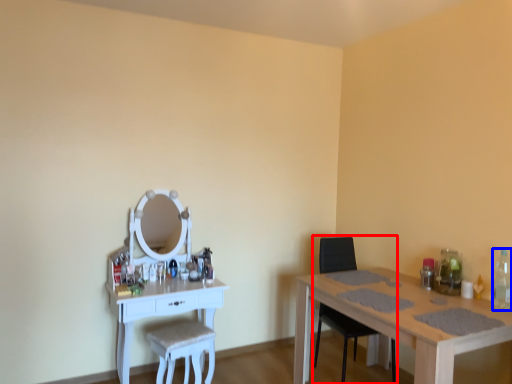
Question: Which object appears farthest to the camera in this image, chair (highlighted by a red box) or bottle (highlighted by a blue box)?

Choices:
 (A) chair
 (B) bottle

Answer: (A)